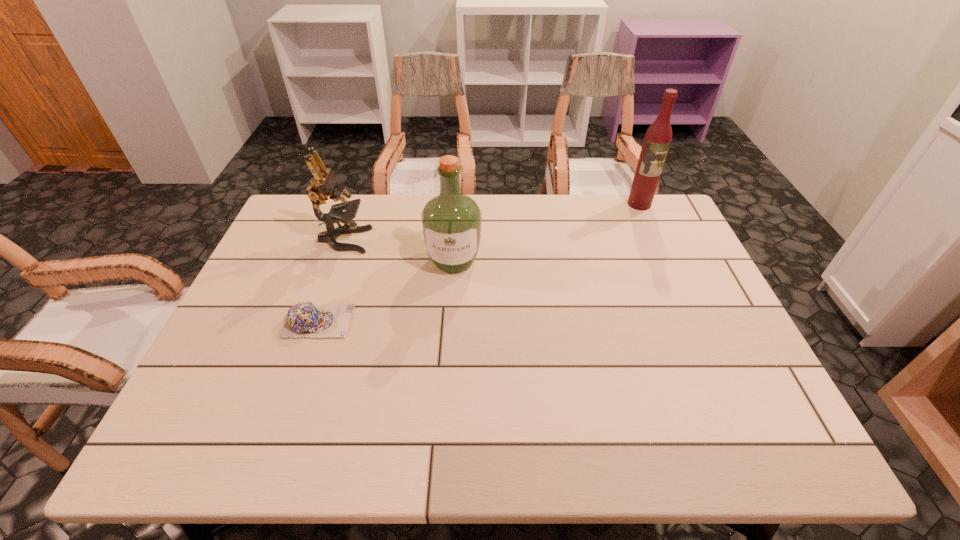
Image resolution: width=960 pixels, height=540 pixels. Identify the location of vacant position at the left edge of the desktop. (264, 290).

You are a GUI agent. You are given a task and a screenshot of the screen. Output one action in this format:
    pyautogui.click(x=<x>, y=<y>)
    Task: Click on the vacant area at the right edge
    
    Given the screenshot: What is the action you would take?
    pyautogui.click(x=713, y=372)

I want to click on blank space at the near right corner of the desktop, so click(738, 436).

Locate an element on the screen. The image size is (960, 540). vacant space that's between the nearer liquor and the microscope is located at coordinates (398, 251).

Identify the location of blank region between the nearest object and the microscope. This screenshot has height=540, width=960. (331, 281).

Locate an element on the screen. Image resolution: width=960 pixels, height=540 pixels. vacant space that is in between the left liquor and the shortest object is located at coordinates (386, 291).

I want to click on vacant area that lies between the nearest object and the nearer liquor, so click(x=386, y=291).

The image size is (960, 540). Find the location of `unoccupied position between the microscope and the right liquor`. unoccupied position between the microscope and the right liquor is located at coordinates (492, 222).

I want to click on free space between the microscope and the left liquor, so click(x=398, y=251).

The image size is (960, 540). Find the location of `free space between the right liquor and the microscope`. free space between the right liquor and the microscope is located at coordinates (492, 222).